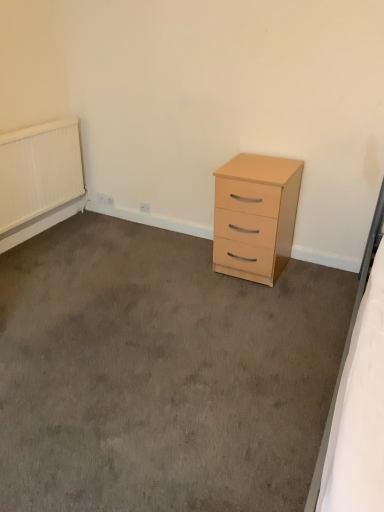
Identify the location of free space to the left of light wood/finish chest of drawers at center-right. The height and width of the screenshot is (512, 384). (187, 264).